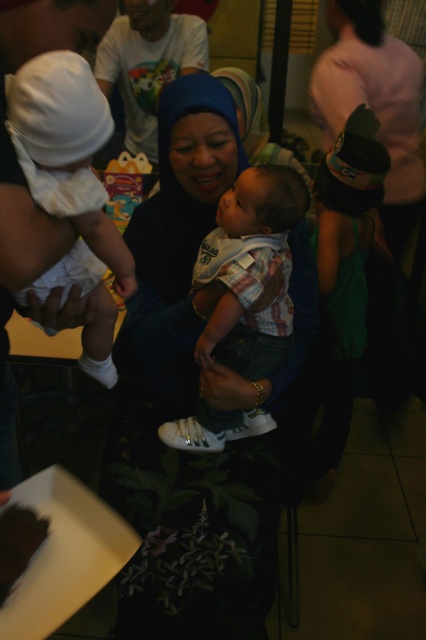
You are a photographer at a social event and notice the blue fabric hijab at center and the white cotton hat at left. Which item is covering the other?

The blue fabric hijab at center is positioned over the white cotton hat at left, so the hijab is covering the hat.

You are a photographer standing 1.5 meters away from the blue fabric hijab at center. Can you reach it without moving your feet?

The distance between you and the blue fabric hijab at center is 1.15 meters, so yes, you can reach it without moving your feet since you are only 1.15 meters away.

You are organizing a photo shoot and need to ensure that all items are visible in the frame. Given that the white cotton hat at left and the white cotton shirt at upper center are both white, how might their sizes affect their visibility?

The white cotton hat at left occupies less space than the white cotton shirt at upper center, so the shirt may be more visible due to its larger size.